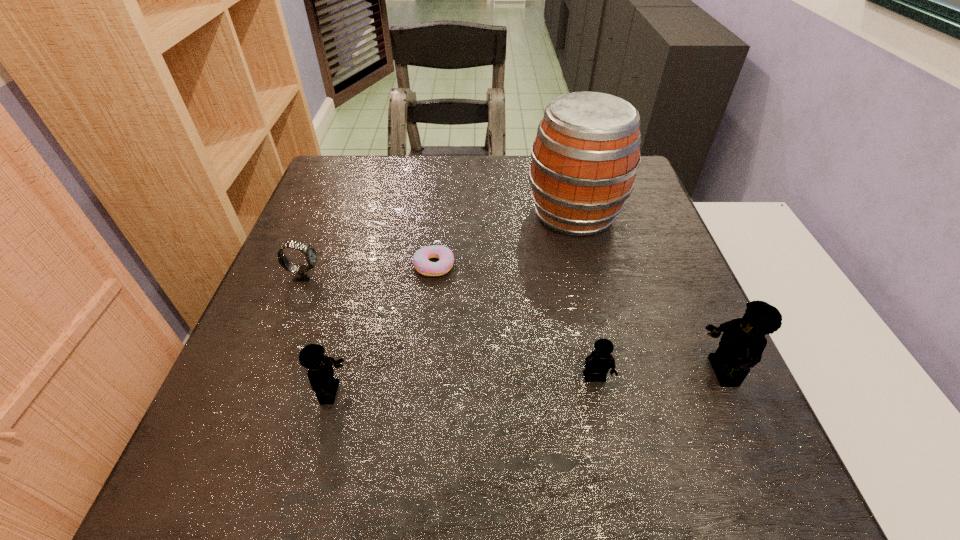
In order to click on watch that is at the left edge in this screenshot , I will do `click(304, 273)`.

The width and height of the screenshot is (960, 540). I want to click on Lego located in the right edge section of the desktop, so click(x=743, y=341).

At what (x,y) coordinates should I click in order to perform the action: click on cider present at the right edge. Please return your answer as a coordinate pair (x, y). The image size is (960, 540). Looking at the image, I should click on (584, 160).

You are a GUI agent. You are given a task and a screenshot of the screen. Output one action in this format:
    pyautogui.click(x=<x>, y=<y>)
    Task: Click on the object present at the near left corner
    Image resolution: width=960 pixels, height=540 pixels.
    Given the screenshot: What is the action you would take?
    pyautogui.click(x=320, y=372)

Where is `object that is at the far right corner`? object that is at the far right corner is located at coordinates (584, 160).

Identify the location of object at the near right corner. The image size is (960, 540). (743, 341).

I want to click on free space at the far edge of the desktop, so click(391, 161).

Where is `free space at the near edge`? Image resolution: width=960 pixels, height=540 pixels. free space at the near edge is located at coordinates (462, 410).

Identify the location of vacant area at the left edge of the desktop. (304, 256).

Where is `vacant space at the right edge of the desktop`? vacant space at the right edge of the desktop is located at coordinates (678, 306).